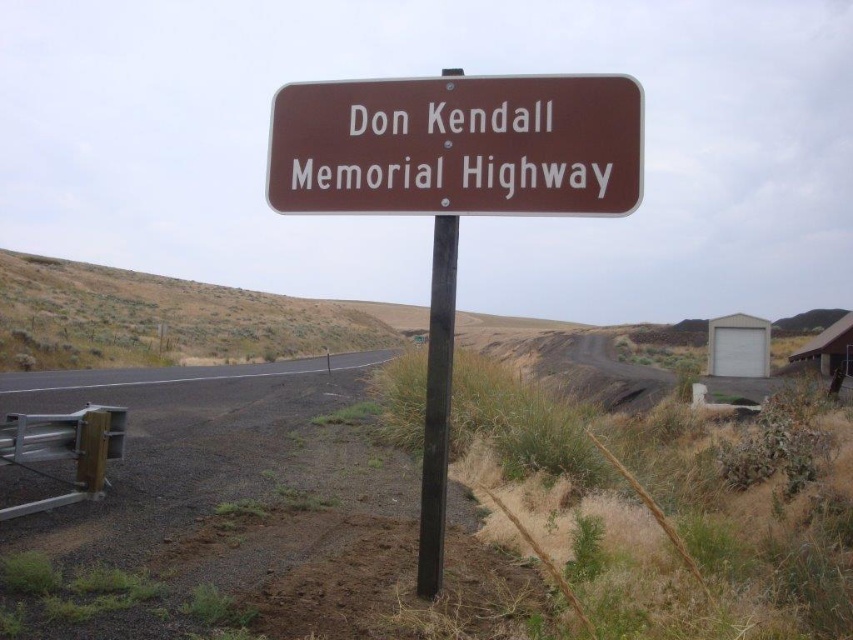
You are standing at the roadside scene with the brown rectangular road sign. You notice two points marked as point 1 and point 2. If you look at point 1 at (357, 141) and point 2 at (440, 317), which point is closer to you?

Point 1 at (357, 141) is closer to you because it is further to the camera than point 2 at (440, 317).

You are driving along the desert road and see the brown metallic sign at center and the black metal pole at center. Which object is shorter?

The brown metallic sign at center is shorter than the black metal pole at center.